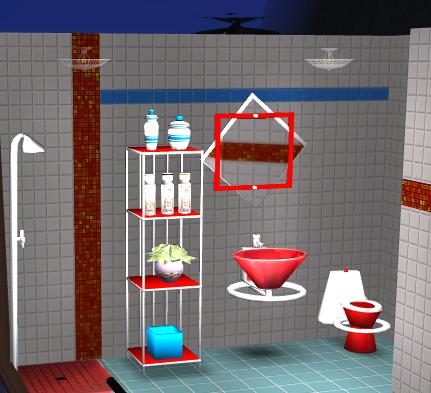
Image resolution: width=431 pixels, height=393 pixels. I want to click on handle, so click(25, 238).